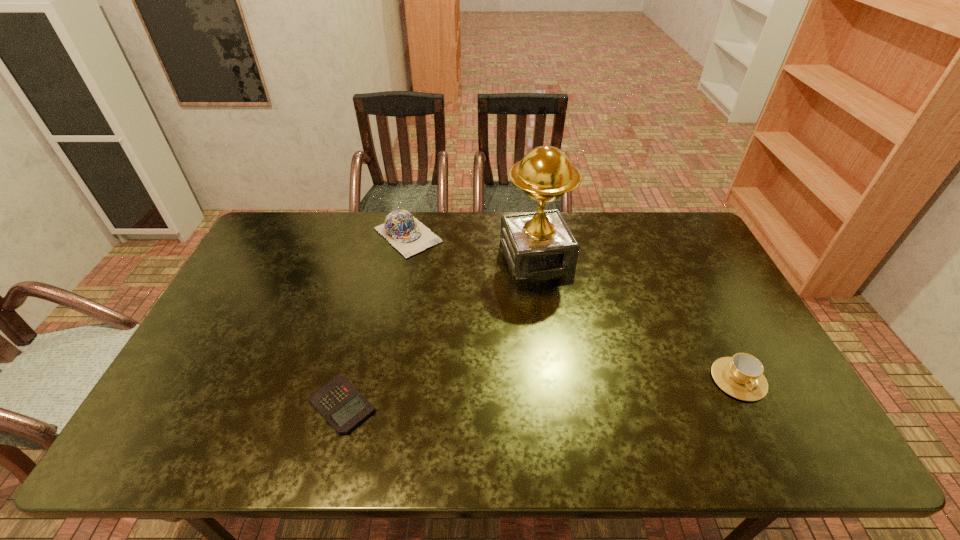
This screenshot has width=960, height=540. I want to click on vacant space on the desktop that is between the shortest object and the cup and is positioned on the front, side, and top of the second tallest object, so click(581, 389).

Where is `vacant spot on the desktop that is between the shortest object and the third tallest object and is positioned on the front-facing side of the tallest object`? This screenshot has width=960, height=540. vacant spot on the desktop that is between the shortest object and the third tallest object and is positioned on the front-facing side of the tallest object is located at coordinates (597, 388).